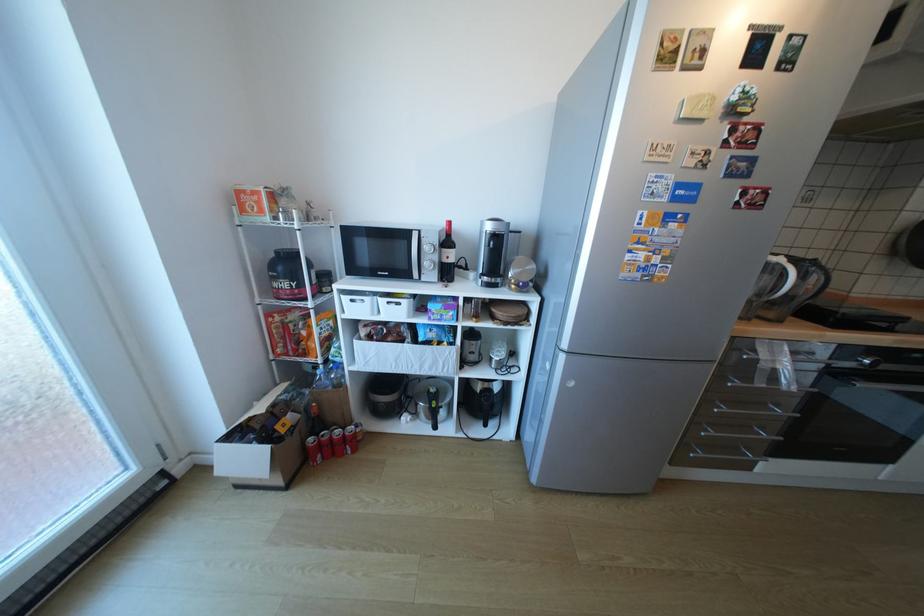
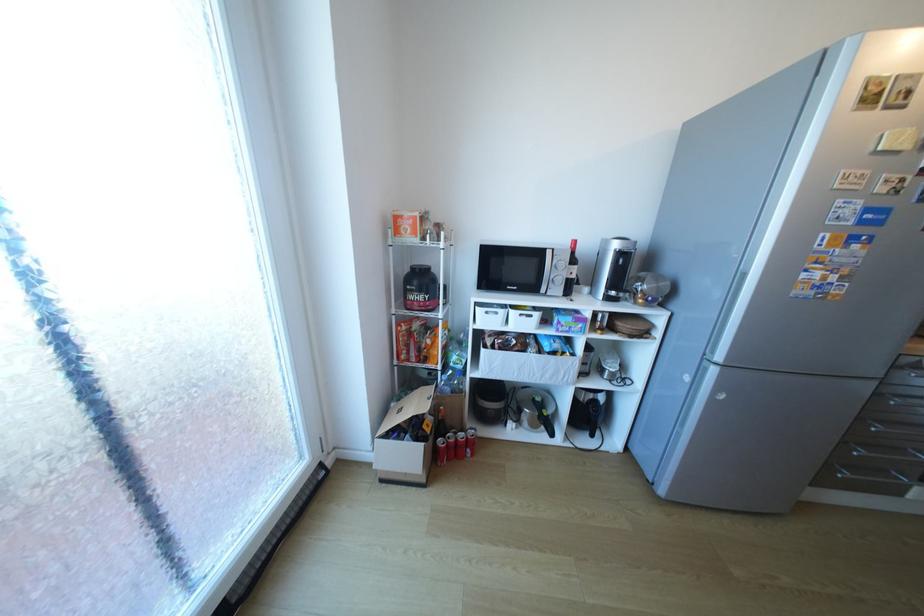
Question: I am providing you with two images of the same scene from different viewpoints. Please identify which objects are invisible in image2.

Choices:
 (A) black pot handle
 (B) white fabric bin
 (C) black appliance handle
 (D) none of these

Answer: (D)